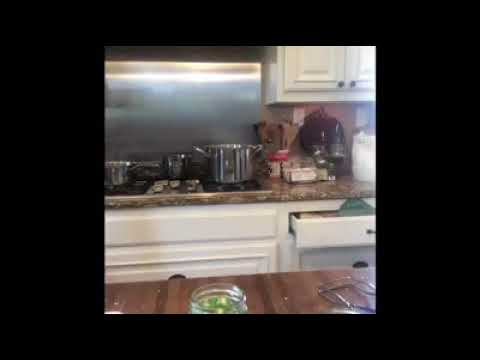
At what (x,y) coordinates should I click in order to perform the action: click on drawer. Please return your answer as a coordinate pair (x, y). The height and width of the screenshot is (360, 480). Looking at the image, I should click on (325, 224).